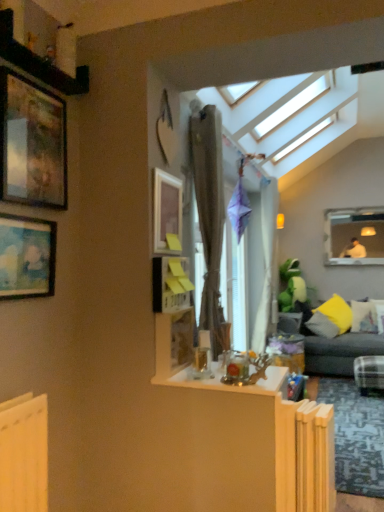
Question: From a real-world perspective, is wooden picture frame at center, marked as the fourth picture frame in a top-to-bottom arrangement, above or below yellow fabric pillow at right, arranged as the 1th pillow when viewed from the right?

Choices:
 (A) below
 (B) above

Answer: (B)

Question: Considering the positions of wooden picture frame at center, which ranks as the first picture frame in bottom-to-top order, and yellow fabric pillow at right, arranged as the 1th pillow when viewed from the right, in the image, is wooden picture frame at center, which ranks as the first picture frame in bottom-to-top order, taller or shorter than yellow fabric pillow at right, arranged as the 1th pillow when viewed from the right,?

Choices:
 (A) tall
 (B) short

Answer: (B)

Question: Estimate the real-world distances between objects in this image. Which object is closer to the matte wooden picture frame at upper left, which ranks as the second picture frame in left-to-right order?

Choices:
 (A) yellow fabric pillow at right, which is counted as the 3th pillow, starting from the right
 (B) matte wooden picture frame at upper center, marked as the 2th picture frame in a top-to-bottom arrangement
 (C) yellow fabric pillow at right, arranged as the 1th pillow when viewed from the right
 (D) dark gray fabric couch at right
 (E) clear glass table at center

Answer: (B)

Question: Which is nearer to the wooden picture frame at center, positioned as the first picture frame in right-to-left order?

Choices:
 (A) yellow fabric pillow at right, which is counted as the 3th pillow, starting from the right
 (B) matte wooden picture frame at upper left, which is the 3th picture frame from top to bottom
 (C) yellow fabric pillow at right, the second pillow viewed from the right
 (D) brown textured curtain at center
 (E) dark gray fabric couch at right

Answer: (D)